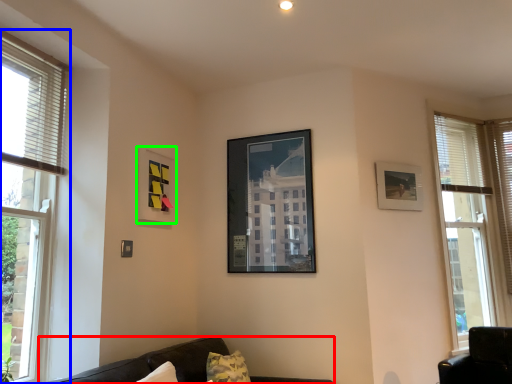
Question: Which object is positioned closest to studio couch (highlighted by a red box)? Select from window (highlighted by a blue box) and picture frame (highlighted by a green box).

Choices:
 (A) window
 (B) picture frame

Answer: (A)